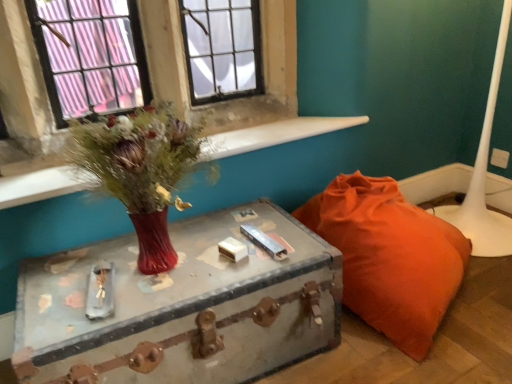
Describe the element at coordinates (484, 176) in the screenshot. I see `white glossy table lamp at lower right` at that location.

This screenshot has height=384, width=512. Describe the element at coordinates (390, 257) in the screenshot. I see `orange fabric bean bag at lower right` at that location.

Consider the image. Measure the distance between point (362,198) and camera.

A distance of 1.60 meters exists between point (362,198) and camera.

You are a GUI agent. You are given a task and a screenshot of the screen. Output one action in this format:
    pyautogui.click(x=<x>, y=<y>)
    Task: Click on the matte glass vase at upper left
    The height and width of the screenshot is (384, 512).
    Given the screenshot: What is the action you would take?
    pyautogui.click(x=276, y=134)

Locate an element on the screen. The height and width of the screenshot is (384, 512). matte red vase at upper left is located at coordinates (142, 170).

Which object is thinner, white glossy table lamp at lower right or matte glass vase at upper left?

With smaller width is matte glass vase at upper left.

From a real-world perspective, is white glossy table lamp at lower right on top of matte glass vase at upper left?

No, from a real-world perspective, white glossy table lamp at lower right is not over matte glass vase at upper left

Would you say matte glass vase at upper left is part of white glossy table lamp at lower right's contents?

No, white glossy table lamp at lower right does not contain matte glass vase at upper left.

Measure the distance between white glossy table lamp at lower right and matte glass vase at upper left.

29.62 inches.

Looking at this image, is matte red vase at upper left thinner than orange fabric bean bag at lower right?

Yes.

From the picture: Can you see matte red vase at upper left touching orange fabric bean bag at lower right?

matte red vase at upper left and orange fabric bean bag at lower right are not in contact.

Looking at this image, is matte red vase at upper left taller or shorter than orange fabric bean bag at lower right?

Considering their sizes, matte red vase at upper left has less height than orange fabric bean bag at lower right.

Can you see matte red vase at upper left touching white glossy table lamp at lower right?

No, matte red vase at upper left is not next to white glossy table lamp at lower right.

In the image, is matte red vase at upper left positioned in front of or behind white glossy table lamp at lower right?

matte red vase at upper left is in front of white glossy table lamp at lower right.

Is matte red vase at upper left at the left side of white glossy table lamp at lower right?

Yes, matte red vase at upper left is to the left of white glossy table lamp at lower right.

This screenshot has width=512, height=384. In order to click on floral arrangement in front of the white glossy table lamp at lower right in this screenshot , I will do `click(142, 170)`.

Considering the relative positions of orange fabric bean bag at lower right and white glossy table lamp at lower right in the image provided, is orange fabric bean bag at lower right to the left of white glossy table lamp at lower right from the viewer's perspective?

Yes.

Is point (433, 251) positioned after point (451, 221)?

No, it is not.

Consider the image. Is orange fabric bean bag at lower right far from white glossy table lamp at lower right?

No.

Considering the sizes of orange fabric bean bag at lower right and white glossy table lamp at lower right in the image, is orange fabric bean bag at lower right taller or shorter than white glossy table lamp at lower right?

In the image, orange fabric bean bag at lower right appears to be shorter than white glossy table lamp at lower right.

Measure the distance between matte glass vase at upper left and matte red vase at upper left.

matte glass vase at upper left and matte red vase at upper left are 20.54 inches apart from each other.

Is matte glass vase at upper left positioned with its back to matte red vase at upper left?

No.

Considering the sizes of matte glass vase at upper left and matte red vase at upper left in the image, is matte glass vase at upper left bigger or smaller than matte red vase at upper left?

Clearly, matte glass vase at upper left is smaller in size than matte red vase at upper left.

From the image's perspective, between matte glass vase at upper left and matte red vase at upper left, which one is located above?

matte glass vase at upper left appears higher in the image.

From the image's perspective, is rusty metal trunk at center over matte red vase at upper left?

No, from the image's perspective, rusty metal trunk at center is not on top of matte red vase at upper left.

Who is bigger, rusty metal trunk at center or matte red vase at upper left?

Bigger between the two is rusty metal trunk at center.

Considering the positions of objects rusty metal trunk at center and matte red vase at upper left in the image provided, who is in front, rusty metal trunk at center or matte red vase at upper left?

matte red vase at upper left.

Does point (18, 325) lie behind point (138, 238)?

No, it is not.

Where is `table that appears below the orange fabric bean bag at lower right (from a real-world perspective)`? table that appears below the orange fabric bean bag at lower right (from a real-world perspective) is located at coordinates (184, 308).

Which of these two, rusty metal trunk at center or orange fabric bean bag at lower right, is smaller?

rusty metal trunk at center is smaller.

Considering the points (328, 275) and (381, 240), which point is in front, point (328, 275) or point (381, 240)?

The point (328, 275) is closer to the camera.

I want to click on window sill lying in front of the white glossy table lamp at lower right, so click(x=276, y=134).

The height and width of the screenshot is (384, 512). In order to click on furniture that appears below the matte red vase at upper left (from the image's perspective) in this screenshot , I will do `click(390, 257)`.

When comparing their distances from white glossy table lamp at lower right, does orange fabric bean bag at lower right or matte red vase at upper left seem closer?

Among the two, orange fabric bean bag at lower right is located nearer to white glossy table lamp at lower right.

From the image, which object appears to be nearer to matte glass vase at upper left, orange fabric bean bag at lower right or white glossy table lamp at lower right?

Among the two, orange fabric bean bag at lower right is located nearer to matte glass vase at upper left.

When comparing their distances from matte glass vase at upper left, does white glossy table lamp at lower right or matte red vase at upper left seem further?

Based on the image, white glossy table lamp at lower right appears to be further to matte glass vase at upper left.

Looking at the image, which one is located closer to white glossy table lamp at lower right, matte red vase at upper left or rusty metal trunk at center?

rusty metal trunk at center lies closer to white glossy table lamp at lower right than the other object.

Based on their spatial positions, is matte glass vase at upper left or white glossy table lamp at lower right closer to matte red vase at upper left?

matte glass vase at upper left.

Considering their positions, is rusty metal trunk at center positioned further to matte red vase at upper left than orange fabric bean bag at lower right?

orange fabric bean bag at lower right.

Looking at the image, which one is located further to white glossy table lamp at lower right, rusty metal trunk at center or matte red vase at upper left?

matte red vase at upper left.

From the image, which object appears to be farther from matte glass vase at upper left, white glossy table lamp at lower right or rusty metal trunk at center?

The object further to matte glass vase at upper left is white glossy table lamp at lower right.

Image resolution: width=512 pixels, height=384 pixels. Identify the location of table between matte red vase at upper left and orange fabric bean bag at lower right in the horizontal direction. pyautogui.click(x=184, y=308).

Find the location of a particular element. The width and height of the screenshot is (512, 384). table between matte red vase at upper left and white glossy table lamp at lower right is located at coordinates (184, 308).

Where is `window sill between matte red vase at upper left and orange fabric bean bag at lower right from left to right`? The image size is (512, 384). window sill between matte red vase at upper left and orange fabric bean bag at lower right from left to right is located at coordinates (276, 134).

You are a GUI agent. You are given a task and a screenshot of the screen. Output one action in this format:
    pyautogui.click(x=<x>, y=<y>)
    Task: Click on the floral arrangement between matte glass vase at upper left and rusty metal trunk at center from top to bottom
    This screenshot has width=512, height=384.
    Given the screenshot: What is the action you would take?
    pyautogui.click(x=142, y=170)